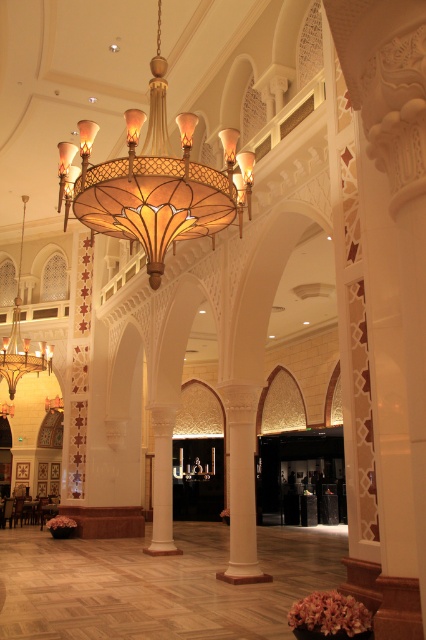
You are an interior designer assessing the lighting in this space. You need to determine which chandelier is taller between the matte glass chandelier at center and the matte gold chandelier at upper center. Which one is taller?

The matte glass chandelier at center is taller than the matte gold chandelier at upper center.

You are standing in the luxurious interior space with the ornate chandelier above you. There are two points marked in the scene. From your perspective, which point is closer to you, the point at coordinates [207,193] or the point at [13,390]?

Point [207,193] is in front of point [13,390], so it is closer to you.